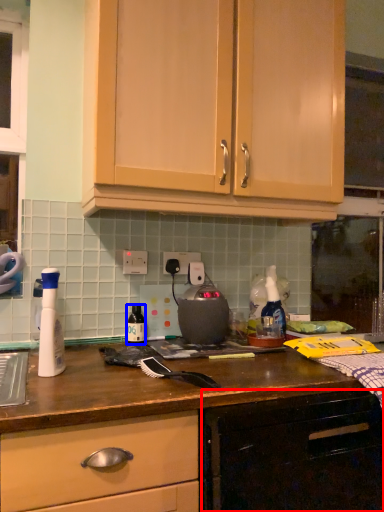
Question: Among these objects, which one is farthest to the camera, cabinetry (highlighted by a red box) or bottle (highlighted by a blue box)?

Choices:
 (A) cabinetry
 (B) bottle

Answer: (B)